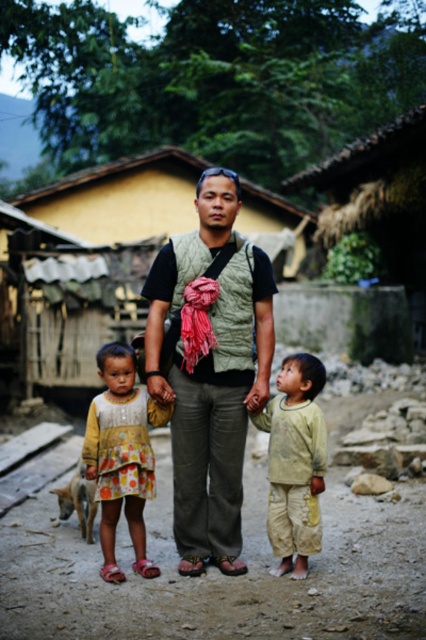
Question: Which object is the closest to the light green fabric pants at center?

Choices:
 (A) polka dot dress at center
 (B) green textured vest at center

Answer: (B)

Question: Is green textured vest at center to the right of polka dot dress at center from the viewer's perspective?

Choices:
 (A) no
 (B) yes

Answer: (B)

Question: Which object is the closest to the light green fabric pants at center?

Choices:
 (A) polka dot dress at center
 (B) green textured vest at center

Answer: (B)

Question: Is green textured vest at center bigger than polka dot dress at center?

Choices:
 (A) no
 (B) yes

Answer: (B)

Question: Which of the following is the farthest from the observer?

Choices:
 (A) (281, 483)
 (B) (120, 476)

Answer: (B)

Question: Is polka dot dress at center to the left of light green fabric pants at center from the viewer's perspective?

Choices:
 (A) yes
 (B) no

Answer: (A)